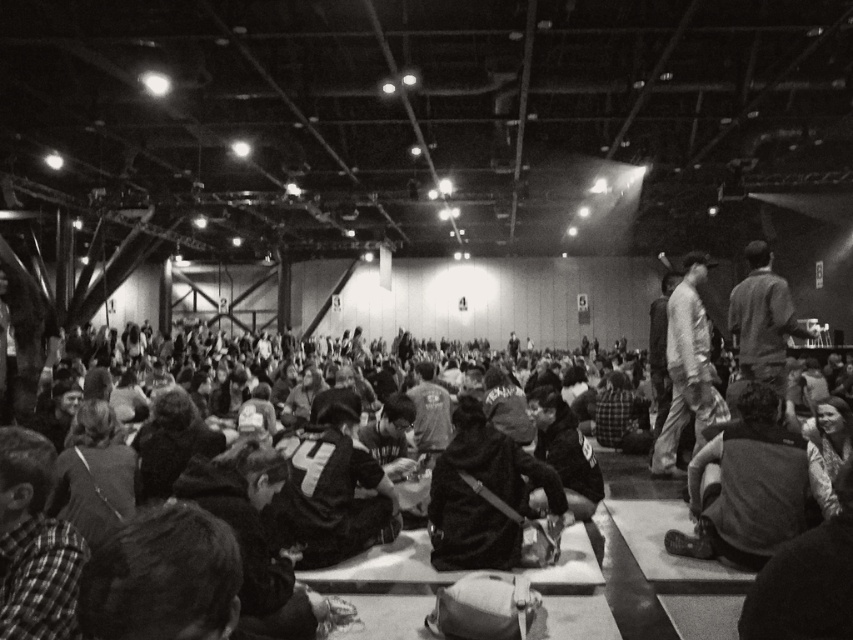
Question: Is dark gray hoodie at lower right to the left of dark gray fabric jacket at center from the viewer's perspective?

Choices:
 (A) no
 (B) yes

Answer: (A)

Question: Is dark gray hoodie at lower right below dark gray fabric jacket at center?

Choices:
 (A) yes
 (B) no

Answer: (A)

Question: Which point is farther to the camera?

Choices:
 (A) pyautogui.click(x=674, y=547)
 (B) pyautogui.click(x=480, y=428)

Answer: (A)

Question: Which object appears closest to the camera in this image?

Choices:
 (A) dark gray fabric jacket at center
 (B) dark gray hoodie at lower right

Answer: (B)

Question: Is dark gray hoodie at lower right thinner than dark gray fabric jacket at center?

Choices:
 (A) yes
 (B) no

Answer: (A)